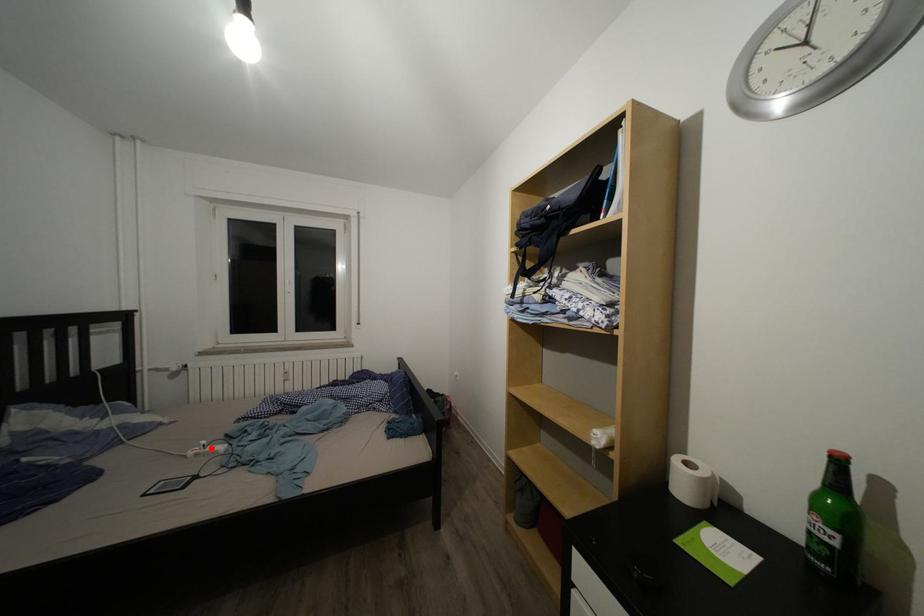
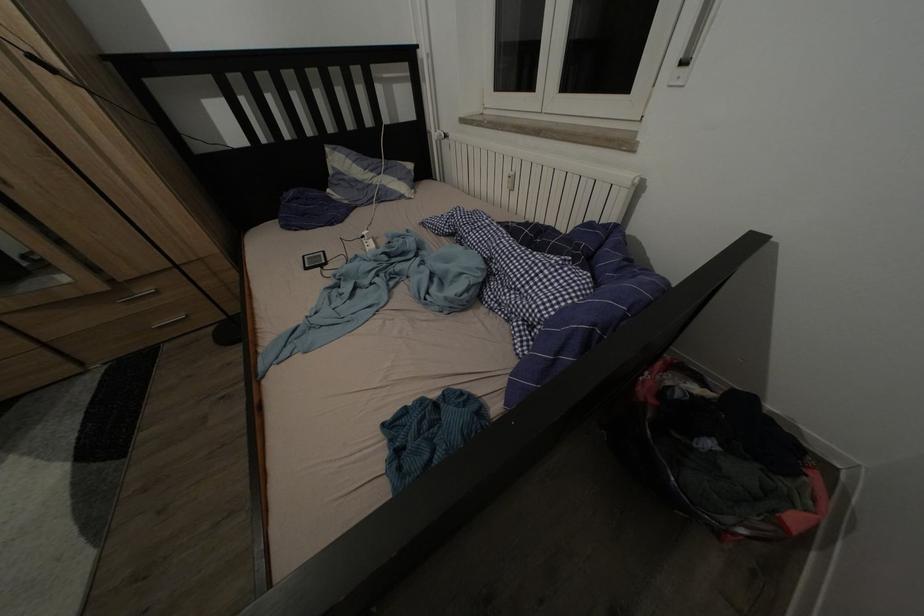
Question: I am providing you with two images of the same scene from different viewpoints. In image1, a red point is highlighted. Considering the same 3D point in image2, which of the following is correct?

Choices:
 (A) It is closer
 (B) It is farther

Answer: (B)